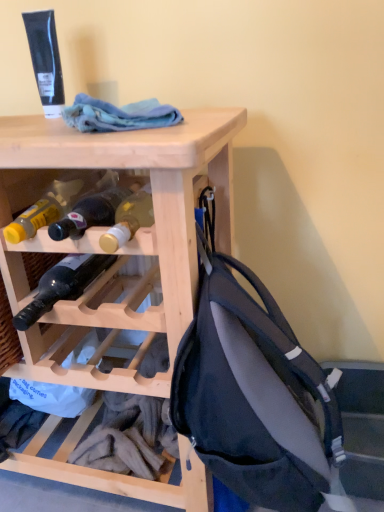
Locate an element on the screen. The height and width of the screenshot is (512, 384). free space on the front side of blue cotton cloth at upper center is located at coordinates (119, 134).